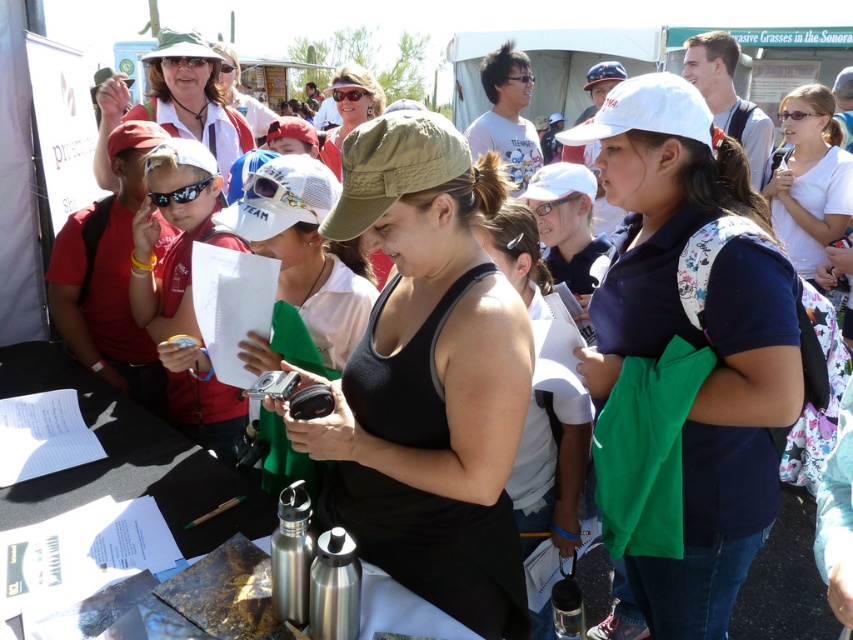
Question: Which object is the closest to the navy blue polo shirt at center?

Choices:
 (A) matte khaki cap at center
 (B) matte white hat at upper center

Answer: (B)

Question: Which of the following is the farthest from the observer?

Choices:
 (A) white cotton shirt at upper right
 (B) green fabric baseball cap at center
 (C) black matte tank top at center

Answer: (A)

Question: Considering the relative positions of black matte tank top at center and matte khaki cap at center in the image provided, where is black matte tank top at center located with respect to matte khaki cap at center?

Choices:
 (A) above
 (B) below

Answer: (B)

Question: Does matte red shirt at center appear on the left side of matte white hat at upper center?

Choices:
 (A) yes
 (B) no

Answer: (B)

Question: Does green fabric baseball cap at center appear on the left side of matte khaki cap at center?

Choices:
 (A) no
 (B) yes

Answer: (A)

Question: Estimate the real-world distances between objects in this image. Which object is closer to the white cotton shirt at upper right?

Choices:
 (A) navy blue polo shirt at center
 (B) green fabric baseball cap at center
 (C) matte red shirt at center
 (D) matte khaki cap at center

Answer: (A)